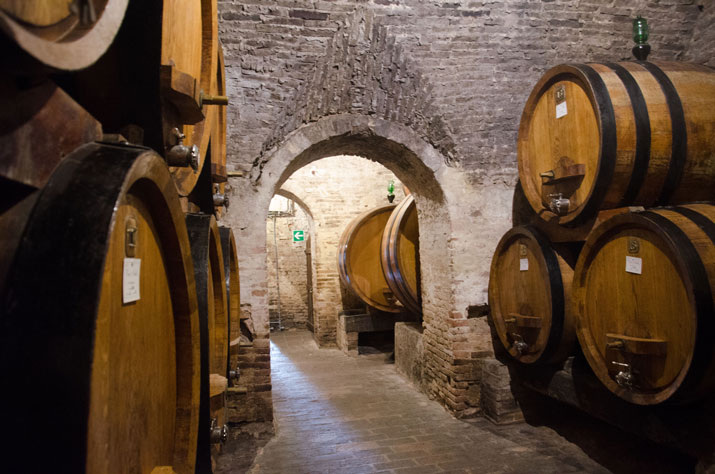
Identify the location of archway. (290, 153), (429, 164), (370, 133).